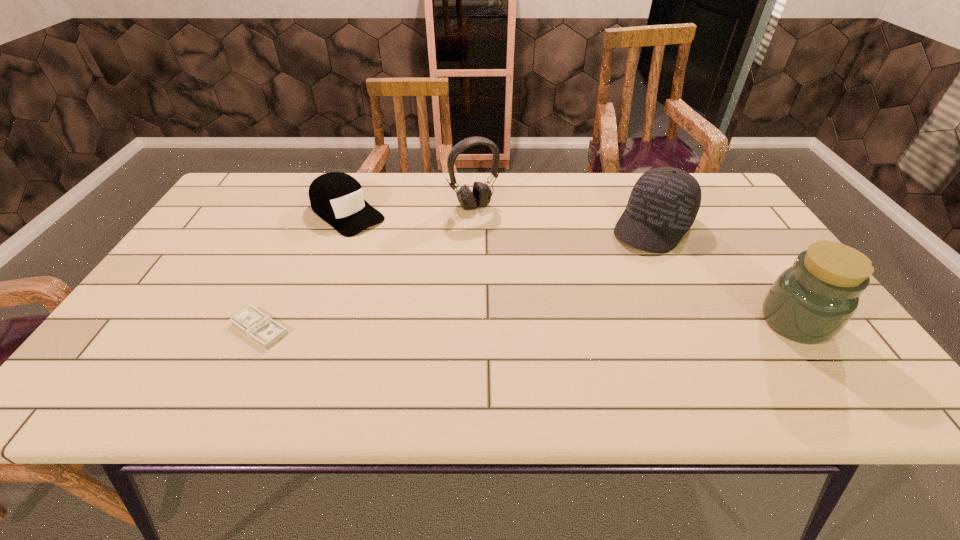
This screenshot has width=960, height=540. I want to click on money positioned at the near edge, so click(x=261, y=328).

The image size is (960, 540). What are the coordinates of `jar that is at the near edge` in the screenshot? It's located at (810, 302).

Image resolution: width=960 pixels, height=540 pixels. In order to click on object positioned at the right edge in this screenshot , I will do `click(810, 302)`.

At what (x,y) coordinates should I click in order to perform the action: click on object positioned at the near right corner. Please return your answer as a coordinate pair (x, y). The width and height of the screenshot is (960, 540). Looking at the image, I should click on (810, 302).

Locate an element on the screen. vacant area at the far edge of the desktop is located at coordinates (396, 176).

Where is `free space at the near edge`? This screenshot has width=960, height=540. free space at the near edge is located at coordinates (382, 337).

In the image, there is a desktop. Where is `free space at the right edge`? free space at the right edge is located at coordinates (742, 296).

In the image, there is a desktop. Where is `vacant space at the far left corner`? The image size is (960, 540). vacant space at the far left corner is located at coordinates (270, 190).

This screenshot has width=960, height=540. I want to click on blank space at the far right corner of the desktop, so click(x=716, y=188).

Where is `vacant area that lies between the jar and the cap`? This screenshot has height=540, width=960. vacant area that lies between the jar and the cap is located at coordinates (571, 268).